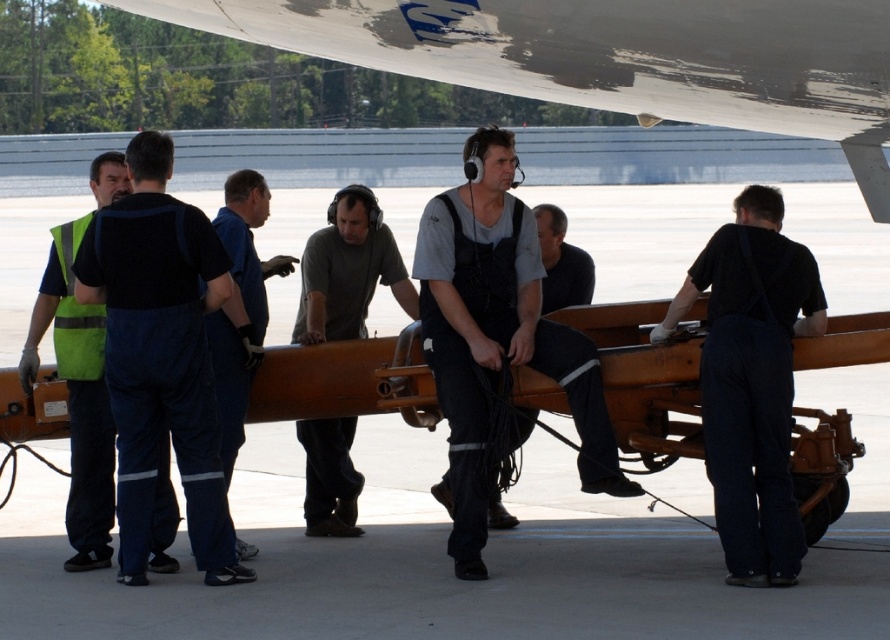
Consider the image. Which is more to the right, reflective green vest at left or blue uniform at center?

blue uniform at center

Which is behind, point (125, 186) or point (261, 304)?

Positioned behind is point (261, 304).

This screenshot has height=640, width=890. What are the coordinates of `reflective green vest at left` in the screenshot? It's located at (77, 397).

How much distance is there between reflective green vest at left and dark gray fabric shirt at center?

The distance of reflective green vest at left from dark gray fabric shirt at center is 2.41 meters.

Between reflective green vest at left and dark gray fabric shirt at center, which one has less height?

dark gray fabric shirt at center

In the scene shown: Measure the distance between point (78,561) and camera.

Point (78,561) is 34.48 feet away from camera.

I want to click on reflective green vest at left, so click(x=77, y=397).

Is dark blue overalls at left taller than blue uniform at center?

Yes, dark blue overalls at left is taller than blue uniform at center.

Can you confirm if dark blue overalls at left is positioned below blue uniform at center?

Correct, dark blue overalls at left is located below blue uniform at center.

Which is behind, point (135, 349) or point (231, 188)?

The point (231, 188) is behind.

Locate an element on the screen. This screenshot has width=890, height=640. dark blue overalls at left is located at coordinates (160, 356).